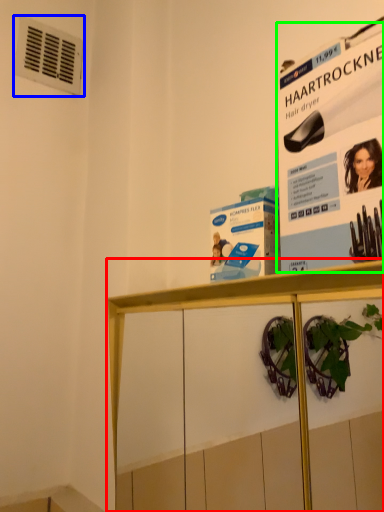
Question: Which is farther away from shelf (highlighted by a red box)? air conditioning (highlighted by a blue box) or poster page (highlighted by a green box)?

Choices:
 (A) air conditioning
 (B) poster page

Answer: (A)